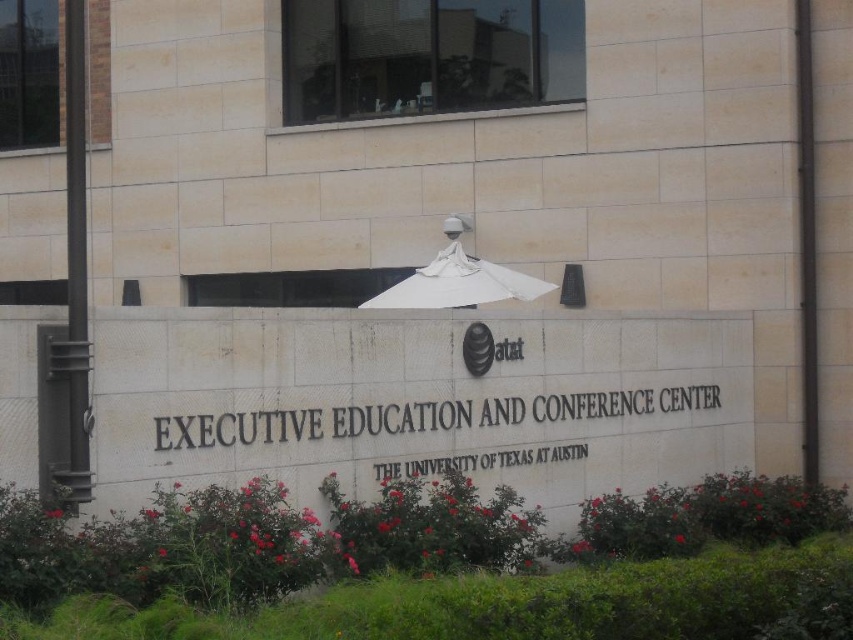
What is the 2D coordinate of the white stone sign at center?

The white stone sign at center is located at the 2D coordinate point of (421, 417).

You are standing at the entrance of the Executive Education and Conference Center at The University of Texas at Austin. You notice a white stone sign at center and a white matte umbrella at center. If you want to place a 3.5 meter long banner between them, will there be enough space?

The white stone sign at center is 3.46 meters from the white matte umbrella at center. Since the banner is 3.5 meters long, which is slightly longer than the distance between them, there won